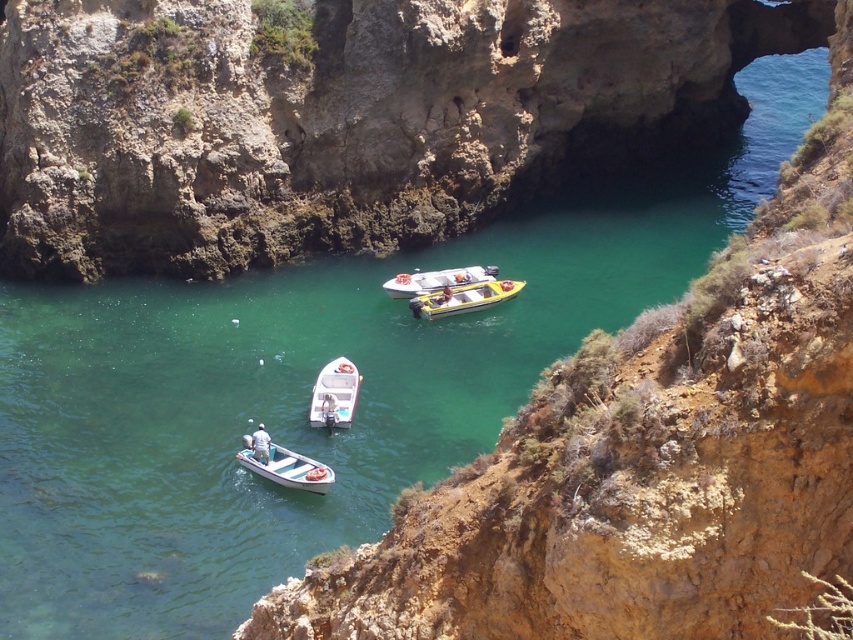
From the picture: You are a photographer planning to take a photo of the yellow rubber boat at center and the white plastic boat at center from the cliff edge. Which boat will appear taller in the photo?

The yellow rubber boat at center will appear taller in the photo because it is much taller than the white plastic boat at center according to the description.